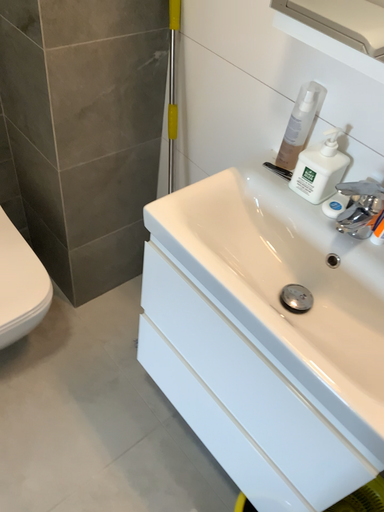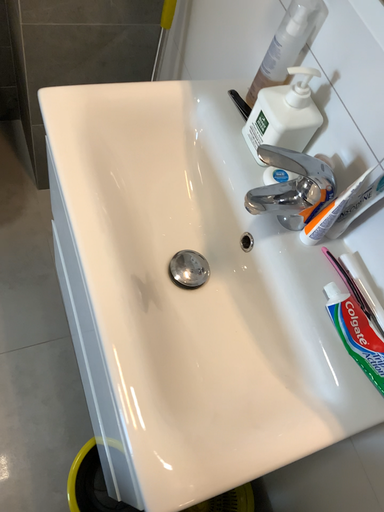
Question: Which way did the camera rotate in the video?

Choices:
 (A) rotated downward
 (B) rotated upward

Answer: (A)